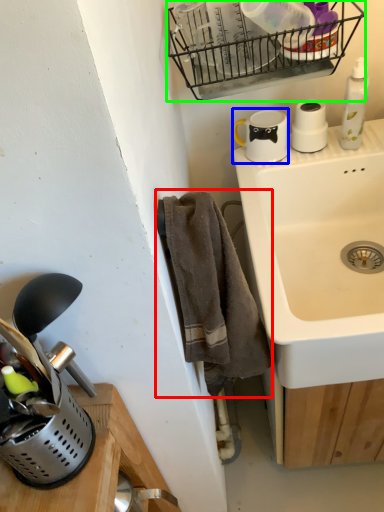
Question: Estimate the real-world distances between objects in this image. Which object is farther from bath towel (highlighted by a red box), appliance (highlighted by a blue box) or basket (highlighted by a green box)?

Choices:
 (A) appliance
 (B) basket

Answer: (B)